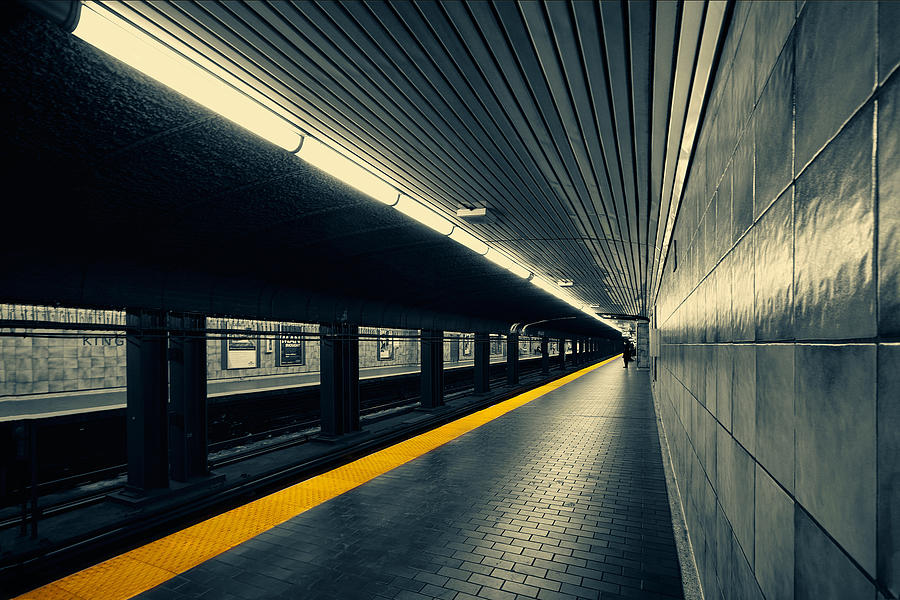
Where is `gray tiled wall`? This screenshot has height=600, width=900. gray tiled wall is located at coordinates (789, 368), (88, 370).